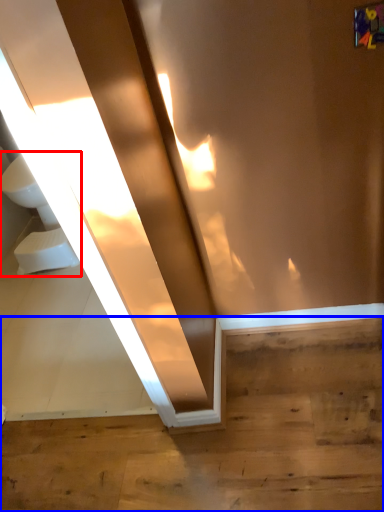
Question: Which object appears farthest to the camera in this image, sink (highlighted by a red box) or stairwell (highlighted by a blue box)?

Choices:
 (A) sink
 (B) stairwell

Answer: (A)